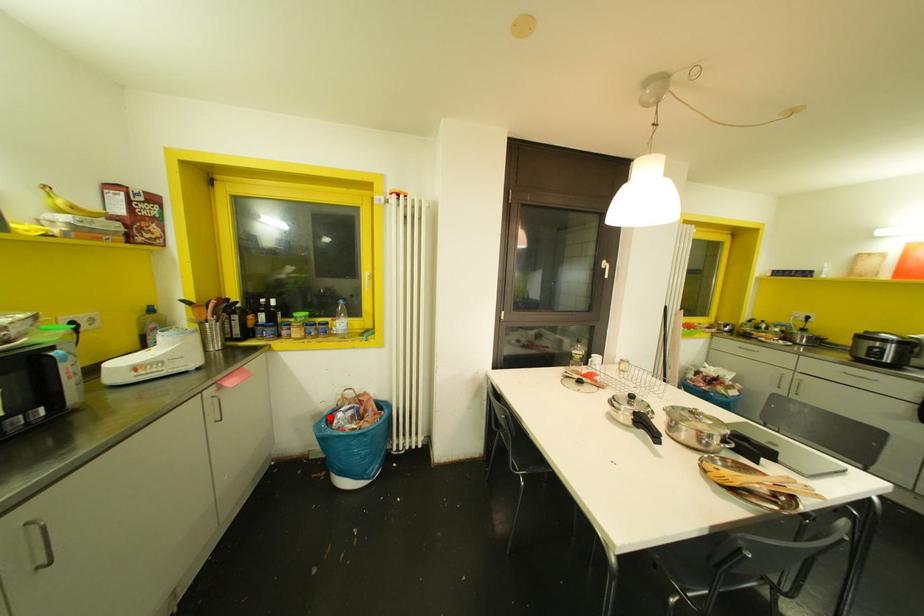
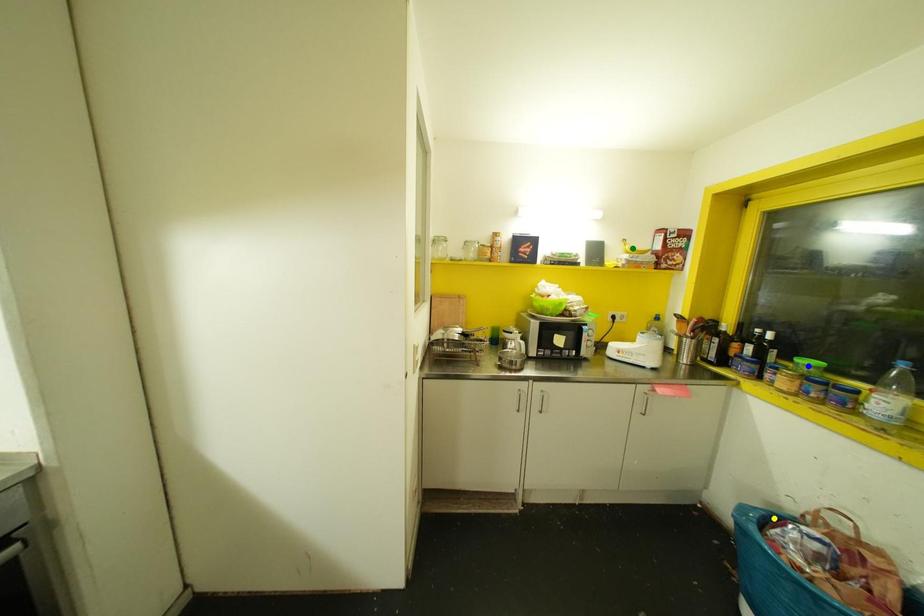
Question: I am providing you with two images of the same scene from different viewpoints. A red point is marked on the first image. You are given multiple points on the second image. Which point in image 2 is actually the same real-world point as the red point in image 1?

Choices:
 (A) green point
 (B) blue point
 (C) yellow point

Answer: (C)